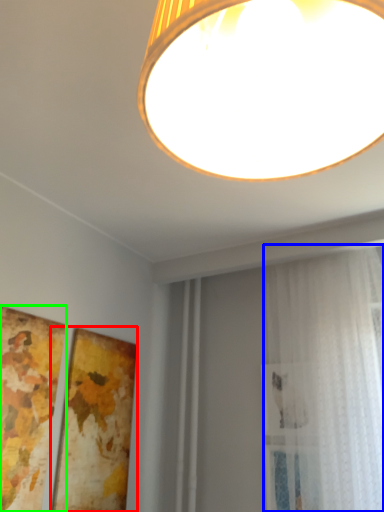
Question: Which is farther away from picture frame (highlighted by a red box)? curtain (highlighted by a blue box) or picture frame (highlighted by a green box)?

Choices:
 (A) curtain
 (B) picture frame

Answer: (A)